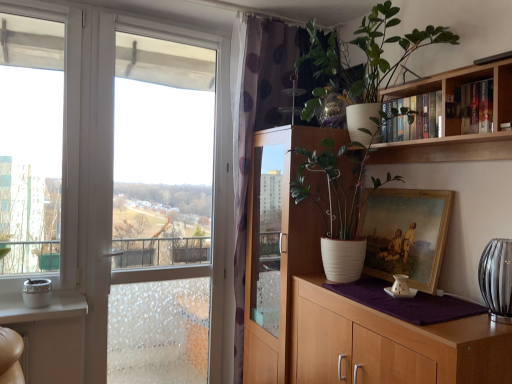
Measure the distance between point (511, 110) and camera.

They are 4.93 feet apart.

Describe the element at coordinates (455, 121) in the screenshot. I see `wooden bookshelf at upper right` at that location.

This screenshot has width=512, height=384. Describe the element at coordinates (161, 211) in the screenshot. I see `clear glass window at left` at that location.

At what (x,y) coordinates should I click in order to perform the action: click on wooden bookshelf at upper right. Please return your answer as a coordinate pair (x, y). The height and width of the screenshot is (384, 512). Looking at the image, I should click on (470, 108).

This screenshot has height=384, width=512. In order to click on translucent glass vase at right in this screenshot , I will do `click(497, 279)`.

At what (x,y) coordinates should I click in order to perform the action: click on white wood cabinet at right, placed as the 2th cabinetry when sorted from front to back. Please return your answer as a coordinate pair (x, y). Looking at the image, I should click on (277, 250).

The image size is (512, 384). Describe the element at coordinates (390, 344) in the screenshot. I see `wooden cabinet at right, acting as the second cabinetry starting from the back` at that location.

The width and height of the screenshot is (512, 384). I want to click on hardcover books at upper right, so click(413, 118).

Can we say white matte pot at upper right, which is counted as the 2th houseplant, starting from the bottom, lies outside wooden bookshelf at upper right?

Absolutely, white matte pot at upper right, which is counted as the 2th houseplant, starting from the bottom, is external to wooden bookshelf at upper right.

Is point (349, 92) farther from viewer compared to point (459, 107)?

Yes, point (349, 92) is behind point (459, 107).

From a real-world perspective, which object stands above the other?

white matte pot at upper right, the first houseplant from the top, is physically above.

Which of these two, white matte pot at upper right, the first houseplant from the top, or wooden bookshelf at upper right, is bigger?

white matte pot at upper right, the first houseplant from the top, is bigger.

From the picture: Between wooden cabinet at right, positioned as the first cabinetry in front-to-back order, and clear glass window at left, which one has smaller width?

clear glass window at left is thinner.

Could you tell me if wooden cabinet at right, positioned as the first cabinetry in front-to-back order, is turned towards clear glass window at left?

No, wooden cabinet at right, positioned as the first cabinetry in front-to-back order, is not aimed at clear glass window at left.

Is wooden cabinet at right, positioned as the first cabinetry in front-to-back order, in front of or behind clear glass window at left in the image?

Visually, wooden cabinet at right, positioned as the first cabinetry in front-to-back order, is located in front of clear glass window at left.

Can you confirm if wooden cabinet at right, acting as the second cabinetry starting from the back, is bigger than clear glass window at left?

A: Correct, wooden cabinet at right, acting as the second cabinetry starting from the back, is larger in size than clear glass window at left.

How far apart are white ceramic pot at upper right, which is the second houseplant from top to bottom, and white matte pot at upper right, which is counted as the 2th houseplant, starting from the bottom?

white ceramic pot at upper right, which is the second houseplant from top to bottom, is 12.81 inches away from white matte pot at upper right, which is counted as the 2th houseplant, starting from the bottom.

From the picture: From the image's perspective, which is above, white ceramic pot at upper right, which is the second houseplant from top to bottom, or white matte pot at upper right, which is counted as the 2th houseplant, starting from the bottom?

white matte pot at upper right, which is counted as the 2th houseplant, starting from the bottom, from the image's perspective.

Image resolution: width=512 pixels, height=384 pixels. In order to click on houseplant on the right of the white ceramic pot at upper right, which ranks as the 1th houseplant in bottom-to-top order in this screenshot , I will do `click(365, 55)`.

Would you say white ceramic pot at upper right, which ranks as the 1th houseplant in bottom-to-top order, contains white matte pot at upper right, which is counted as the 2th houseplant, starting from the bottom?

Definitely not — white matte pot at upper right, which is counted as the 2th houseplant, starting from the bottom, is not inside white ceramic pot at upper right, which ranks as the 1th houseplant in bottom-to-top order.

Between wooden cabinet at right, acting as the second cabinetry starting from the back, and white wood cabinet at right, which is the 1th cabinetry in back-to-front order, which one has less height?

With less height is wooden cabinet at right, acting as the second cabinetry starting from the back.

Is wooden cabinet at right, positioned as the first cabinetry in front-to-back order, behind white wood cabinet at right, which is the 1th cabinetry in back-to-front order?

That is False.

From the image's perspective, who appears lower, wooden cabinet at right, positioned as the first cabinetry in front-to-back order, or white wood cabinet at right, which is the 1th cabinetry in back-to-front order?

From the image's view, wooden cabinet at right, positioned as the first cabinetry in front-to-back order, is below.

How far apart are wooden cabinet at right, positioned as the first cabinetry in front-to-back order, and white wood cabinet at right, placed as the 2th cabinetry when sorted from front to back?

wooden cabinet at right, positioned as the first cabinetry in front-to-back order, and white wood cabinet at right, placed as the 2th cabinetry when sorted from front to back, are 53.25 centimeters apart.

Is white wood cabinet at right, placed as the 2th cabinetry when sorted from front to back, not within white matte pot at upper right, which is counted as the 2th houseplant, starting from the bottom?

Yes, white wood cabinet at right, placed as the 2th cabinetry when sorted from front to back, is outside of white matte pot at upper right, which is counted as the 2th houseplant, starting from the bottom.

Considering the relative sizes of white wood cabinet at right, which is the 1th cabinetry in back-to-front order, and white matte pot at upper right, which is counted as the 2th houseplant, starting from the bottom, in the image provided, is white wood cabinet at right, which is the 1th cabinetry in back-to-front order, taller than white matte pot at upper right, which is counted as the 2th houseplant, starting from the bottom,?

Yes.

Between white wood cabinet at right, which is the 1th cabinetry in back-to-front order, and white matte pot at upper right, the first houseplant from the top, which one has smaller width?

With smaller width is white wood cabinet at right, which is the 1th cabinetry in back-to-front order.

Does wooden cabinet at right, positioned as the first cabinetry in front-to-back order, have a smaller size compared to hardcover books at upper right?

No.

From a real-world perspective, is wooden cabinet at right, positioned as the first cabinetry in front-to-back order, physically above hardcover books at upper right?

No, from a real-world perspective, wooden cabinet at right, positioned as the first cabinetry in front-to-back order, is not above hardcover books at upper right.

I want to click on book that appears above the wooden cabinet at right, acting as the second cabinetry starting from the back (from a real-world perspective), so click(413, 118).

Could you tell me if white ceramic pot at upper right, which is the second houseplant from top to bottom, is turned towards wooden cabinet at right, positioned as the first cabinetry in front-to-back order?

No, white ceramic pot at upper right, which is the second houseplant from top to bottom, is not turned towards wooden cabinet at right, positioned as the first cabinetry in front-to-back order.

Considering the sizes of objects white ceramic pot at upper right, which is the second houseplant from top to bottom, and wooden cabinet at right, acting as the second cabinetry starting from the back, in the image provided, who is taller, white ceramic pot at upper right, which is the second houseplant from top to bottom, or wooden cabinet at right, acting as the second cabinetry starting from the back,?

With more height is white ceramic pot at upper right, which is the second houseplant from top to bottom.

Considering the relative sizes of white ceramic pot at upper right, which is the second houseplant from top to bottom, and wooden cabinet at right, positioned as the first cabinetry in front-to-back order, in the image provided, is white ceramic pot at upper right, which is the second houseplant from top to bottom, bigger than wooden cabinet at right, positioned as the first cabinetry in front-to-back order,?

Incorrect, white ceramic pot at upper right, which is the second houseplant from top to bottom, is not larger than wooden cabinet at right, positioned as the first cabinetry in front-to-back order.

Identify the location of cabinet that appears below the white matte pot at upper right, the first houseplant from the top (from the image's perspective). The image size is (512, 384). (470, 108).

You are a GUI agent. You are given a task and a screenshot of the screen. Output one action in this format:
    pyautogui.click(x=<x>, y=<y>)
    Task: Click on the window frame on the left of wooden cabinet at right, positioned as the first cabinetry in front-to-back order
    This screenshot has height=384, width=512.
    Given the screenshot: What is the action you would take?
    pyautogui.click(x=161, y=211)

From the image, which object appears to be farther from white matte pot at upper right, the first houseplant from the top, clear glass window at left or wooden cabinet at right, positioned as the first cabinetry in front-to-back order?

The object further to white matte pot at upper right, the first houseplant from the top, is clear glass window at left.

When comparing their distances from clear glass window at left, does gold-framed painting at right or white ceramic pot at upper right, which is the second houseplant from top to bottom, seem further?

Among the two, gold-framed painting at right is located further to clear glass window at left.

Which object lies nearer to the anchor point translucent glass vase at right, wooden cabinet at right, positioned as the first cabinetry in front-to-back order, or gold-framed painting at right?

wooden cabinet at right, positioned as the first cabinetry in front-to-back order.

Estimate the real-world distances between objects in this image. Which object is further from white matte pot at upper right, the first houseplant from the top, white wood cabinet at right, placed as the 2th cabinetry when sorted from front to back, or translucent glass vase at right?

translucent glass vase at right lies further to white matte pot at upper right, the first houseplant from the top, than the other object.

When comparing their distances from wooden cabinet at right, acting as the second cabinetry starting from the back, does clear glass window at left or white matte pot at upper right, which is counted as the 2th houseplant, starting from the bottom, seem closer?

white matte pot at upper right, which is counted as the 2th houseplant, starting from the bottom, is closer to wooden cabinet at right, acting as the second cabinetry starting from the back.

Considering their positions, is wooden bookshelf at upper right positioned closer to wooden bookshelf at upper right than white matte pot at upper right, which is counted as the 2th houseplant, starting from the bottom?

wooden bookshelf at upper right is closer to wooden bookshelf at upper right.

When comparing their distances from translucent glass vase at right, does clear glass window at left or white ceramic pot at upper right, which is the second houseplant from top to bottom, seem closer?

white ceramic pot at upper right, which is the second houseplant from top to bottom, is positioned closer to the anchor translucent glass vase at right.

Looking at the image, which one is located closer to translucent glass vase at right, wooden bookshelf at upper right or hardcover books at upper right?

wooden bookshelf at upper right is closer to translucent glass vase at right.

Where is `glass vase between gold-framed painting at right and wooden cabinet at right, acting as the second cabinetry starting from the back, in the up-down direction`? This screenshot has height=384, width=512. glass vase between gold-framed painting at right and wooden cabinet at right, acting as the second cabinetry starting from the back, in the up-down direction is located at coordinates (497, 279).

The width and height of the screenshot is (512, 384). Identify the location of cabinetry between clear glass window at left and white ceramic pot at upper right, which ranks as the 1th houseplant in bottom-to-top order, in the horizontal direction. (277, 250).

Find the location of a particular element. The height and width of the screenshot is (384, 512). glass vase between white ceramic pot at upper right, which ranks as the 1th houseplant in bottom-to-top order, and wooden cabinet at right, positioned as the first cabinetry in front-to-back order, vertically is located at coordinates (497, 279).

Find the location of `picture frame between wooden bookshelf at upper right and translucent glass vase at right vertically`. picture frame between wooden bookshelf at upper right and translucent glass vase at right vertically is located at coordinates (406, 234).